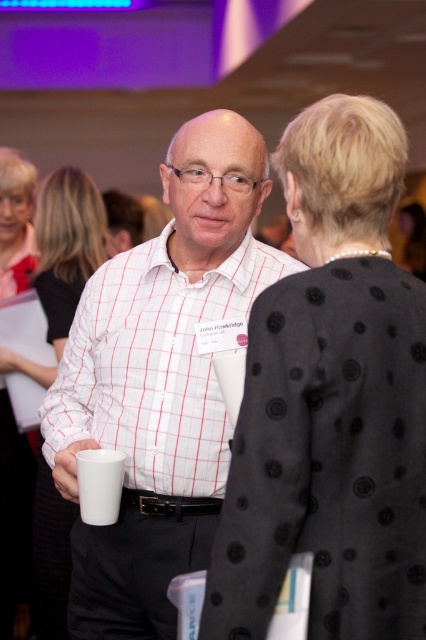
Question: Can you confirm if black dotted jacket at center is positioned to the right of matte white mug at center?

Choices:
 (A) no
 (B) yes

Answer: (B)

Question: Is black dotted jacket at center closer to camera compared to matte white mug at center?

Choices:
 (A) no
 (B) yes

Answer: (B)

Question: Which of these objects is positioned closest to the black dotted jacket at center?

Choices:
 (A) white matte mug at lower left
 (B) matte white mug at center

Answer: (A)

Question: Is matte white mug at center to the left of white matte mug at lower left from the viewer's perspective?

Choices:
 (A) yes
 (B) no

Answer: (A)

Question: Which of the following is the closest to the observer?

Choices:
 (A) white matte mug at lower left
 (B) black dotted jacket at center

Answer: (B)

Question: Which point is farther to the camera?

Choices:
 (A) white matte mug at lower left
 (B) matte white mug at center

Answer: (B)